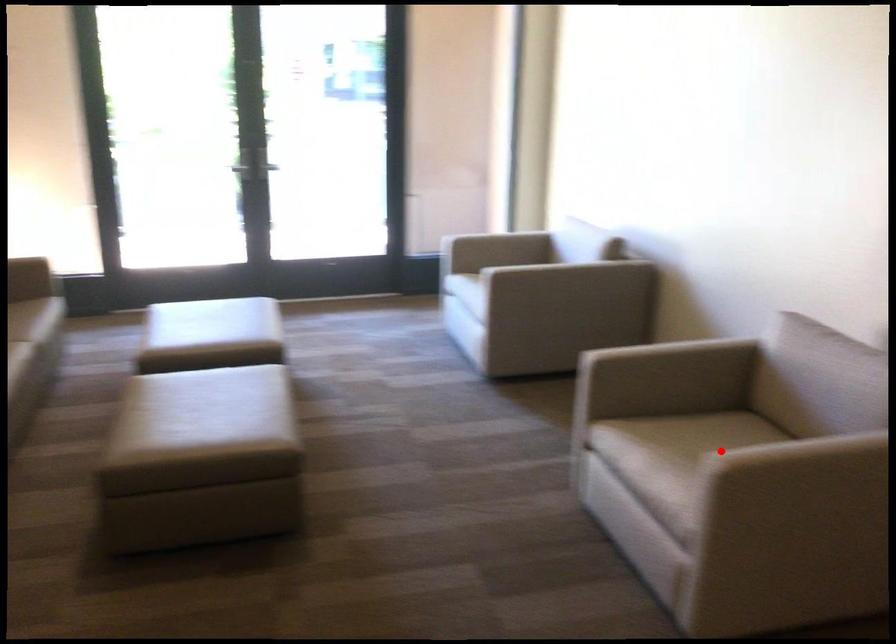
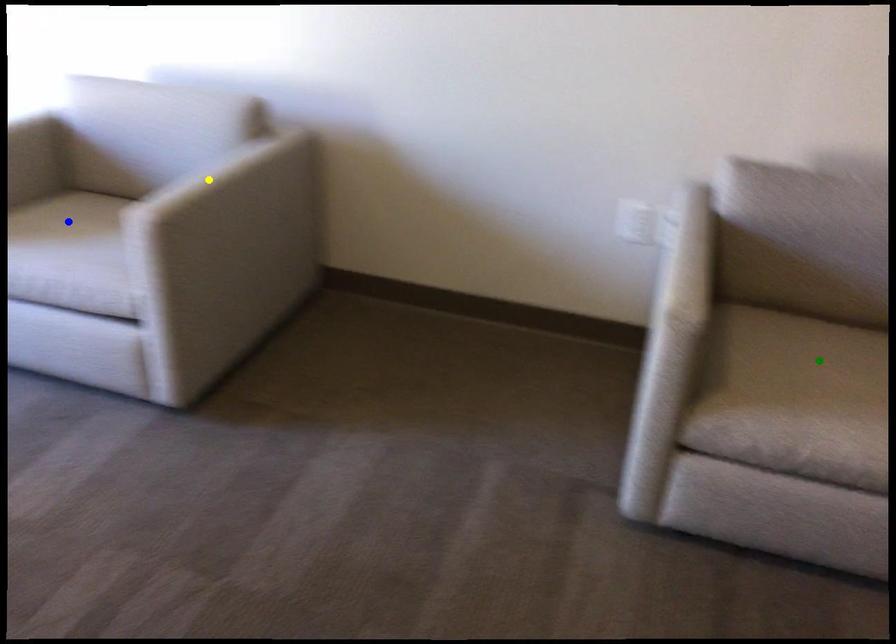
Question: I am providing you with two images of the same scene from different viewpoints. A red point is marked on the first image. You are given multiple points on the second image. Which mark in image 2 goes with the point in image 1?

Choices:
 (A) blue point
 (B) yellow point
 (C) green point

Answer: (C)